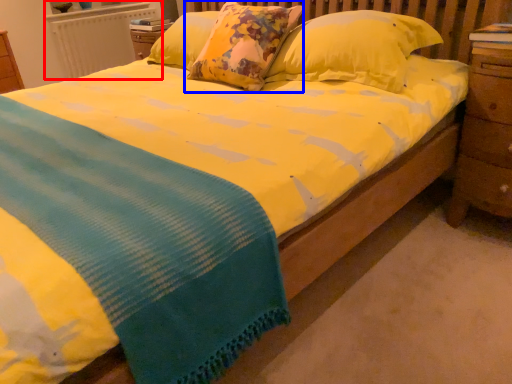
Question: Which object is closer to the camera taking this photo, radiator (highlighted by a red box) or pillow (highlighted by a blue box)?

Choices:
 (A) radiator
 (B) pillow

Answer: (B)